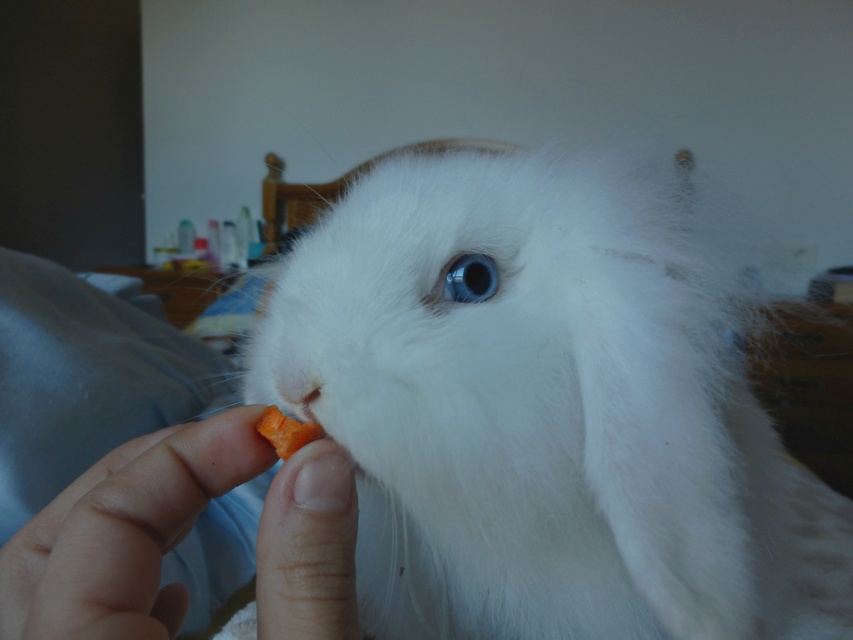
Question: Is white fluffy rabbit at center wider than smooth skin at lower left?

Choices:
 (A) yes
 (B) no

Answer: (A)

Question: In this image, where is white fluffy rabbit at center located relative to smooth skin at lower left?

Choices:
 (A) above
 (B) below

Answer: (B)

Question: Does white fluffy rabbit at center appear on the right side of smooth skin at lower left?

Choices:
 (A) no
 (B) yes

Answer: (B)

Question: Which of the following is the closest to the observer?

Choices:
 (A) (184, 445)
 (B) (410, 637)

Answer: (A)

Question: Which point is closer to the camera?

Choices:
 (A) (827, 598)
 (B) (53, 566)

Answer: (B)